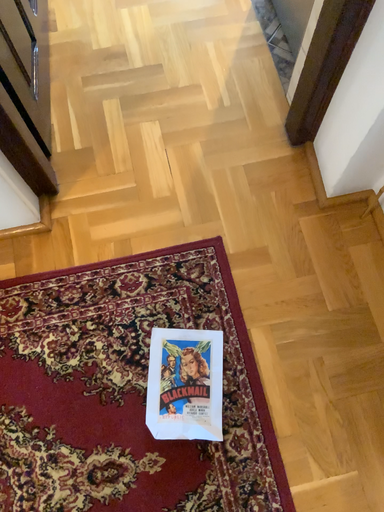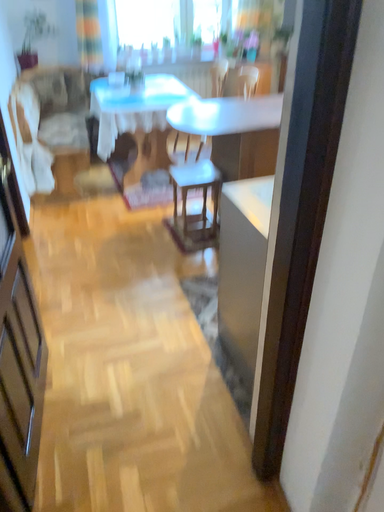
Question: How did the camera likely rotate when shooting the video?

Choices:
 (A) rotated downward
 (B) rotated upward

Answer: (B)